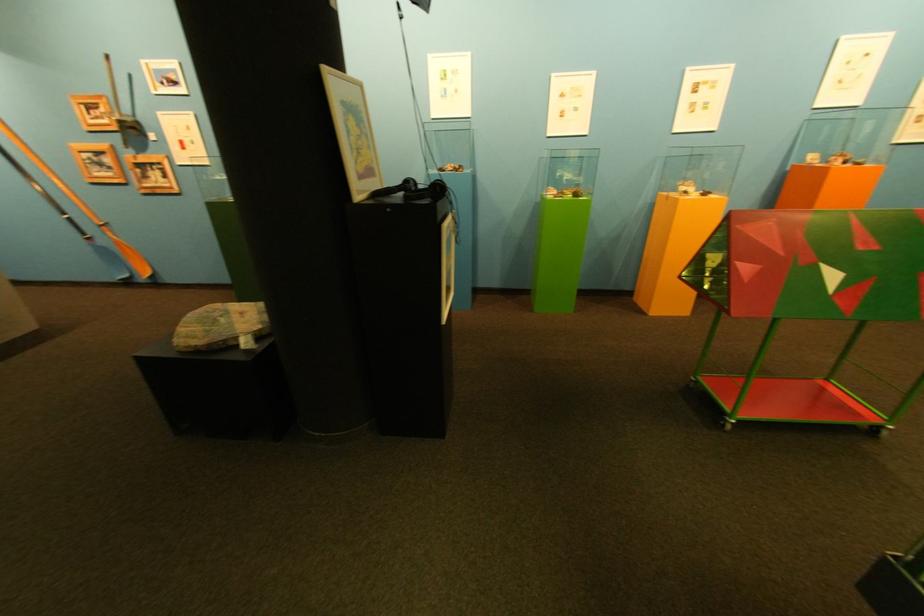
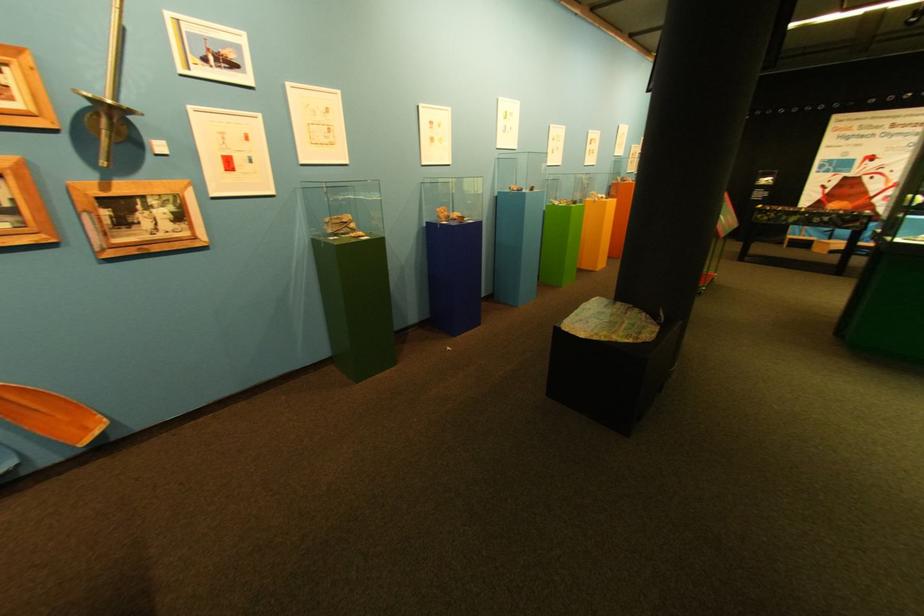
Find the pixel in the second image that matches (x=118, y=111) in the first image.

(22, 81)